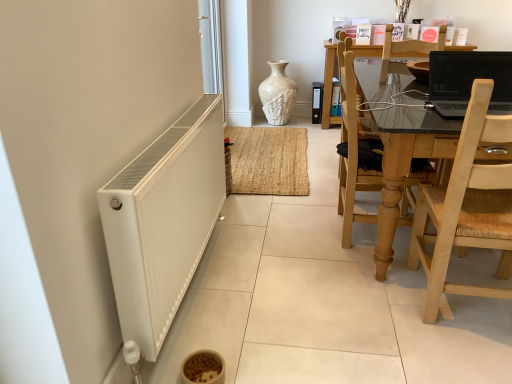
Question: Is white glossy screen door at upper left completely or partially outside of black glossy laptop at upper right?

Choices:
 (A) no
 (B) yes

Answer: (B)

Question: Can you confirm if white glossy screen door at upper left is taller than black glossy laptop at upper right?

Choices:
 (A) no
 (B) yes

Answer: (B)

Question: Is white glossy screen door at upper left far from black glossy laptop at upper right?

Choices:
 (A) yes
 (B) no

Answer: (A)

Question: Is the position of white glossy screen door at upper left less distant than that of black glossy laptop at upper right?

Choices:
 (A) no
 (B) yes

Answer: (A)

Question: Is white glossy screen door at upper left looking in the opposite direction of black glossy laptop at upper right?

Choices:
 (A) no
 (B) yes

Answer: (A)

Question: From their relative heights in the image, would you say white textured vase at center is taller or shorter than light wood woven seat at right, the second chair in the back-to-front sequence?

Choices:
 (A) short
 (B) tall

Answer: (A)

Question: Looking at their shapes, would you say white textured vase at center is wider or thinner than light wood woven seat at right, the second chair in the back-to-front sequence?

Choices:
 (A) wide
 (B) thin

Answer: (B)

Question: From a real-world perspective, relative to light wood woven seat at right, the second chair in the back-to-front sequence, is white textured vase at center vertically above or below?

Choices:
 (A) above
 (B) below

Answer: (B)

Question: Do you think white textured vase at center is within light wood woven seat at right, which appears as the first chair when viewed from the front, or outside of it?

Choices:
 (A) inside
 (B) outside

Answer: (B)

Question: Is black glossy laptop at upper right situated inside white glossy screen door at upper left or outside?

Choices:
 (A) inside
 (B) outside

Answer: (B)

Question: Is point (497, 104) positioned closer to the camera than point (210, 1)?

Choices:
 (A) closer
 (B) farther

Answer: (A)

Question: Considering the relative positions of black glossy laptop at upper right and white glossy screen door at upper left in the image provided, is black glossy laptop at upper right to the left or to the right of white glossy screen door at upper left?

Choices:
 (A) right
 (B) left

Answer: (A)

Question: From a real-world perspective, is black glossy laptop at upper right positioned above or below white glossy screen door at upper left?

Choices:
 (A) below
 (B) above

Answer: (B)

Question: Considering the positions of point (350, 87) and point (205, 31), is point (350, 87) closer or farther from the camera than point (205, 31)?

Choices:
 (A) farther
 (B) closer

Answer: (B)

Question: Is wooden chair at right, positioned as the first chair in back-to-front order, taller or shorter than white glossy screen door at upper left?

Choices:
 (A) short
 (B) tall

Answer: (A)